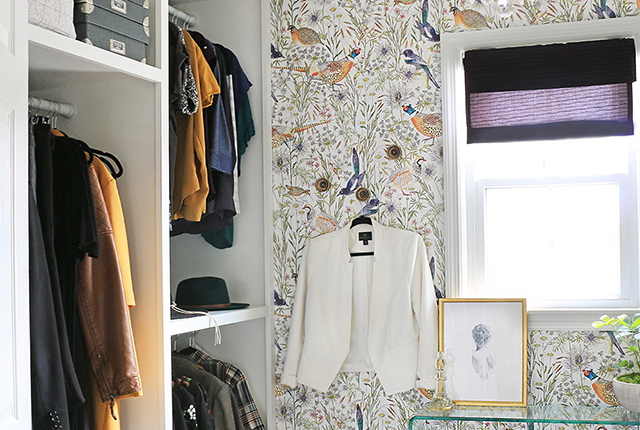
Where is `gold frame`? The width and height of the screenshot is (640, 430). gold frame is located at coordinates (438, 321).